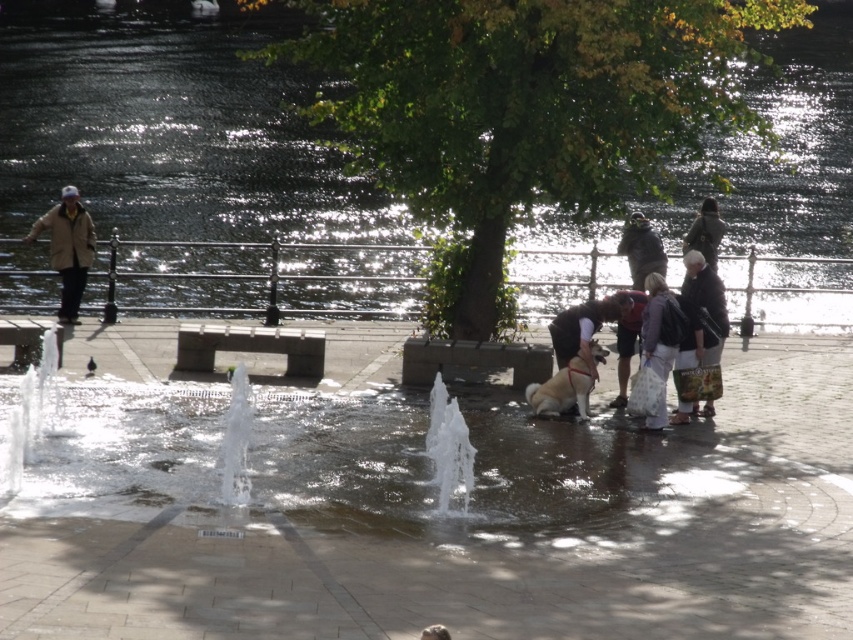
You are standing at the point labeled as point (691, 285) and want to walk towards the point labeled as point (450, 552). Based on the scene description, will you have an unobstructed path?

Yes, you will have an unobstructed path because point (450, 552) is in front of point (691, 285), meaning there are no objects blocking the way between them.

You are a photographer trying to capture the clear water fountain at center and the fuzzy beige dog at center in the same frame. Based on their positions, which object should you adjust your camera to focus on first if you want both to be in focus?

You should focus on the clear water fountain at center first because it is positioned to the left of the fuzzy beige dog at center, so adjusting focus starting from the left ensures both are in frame.

You are a photographer standing at the riverside scene. You want to take a photo that includes both the white textured bag at center right and the dark brown leather jacket at center. However, you notice that one of them is taller than the other. Which object should you position closer to the foreground to ensure both are fully visible in the frame?

Since the white textured bag at center right is taller than the dark brown leather jacket at center, you should position the taller white textured bag at center right closer to the foreground to ensure both objects are fully visible in the frame.